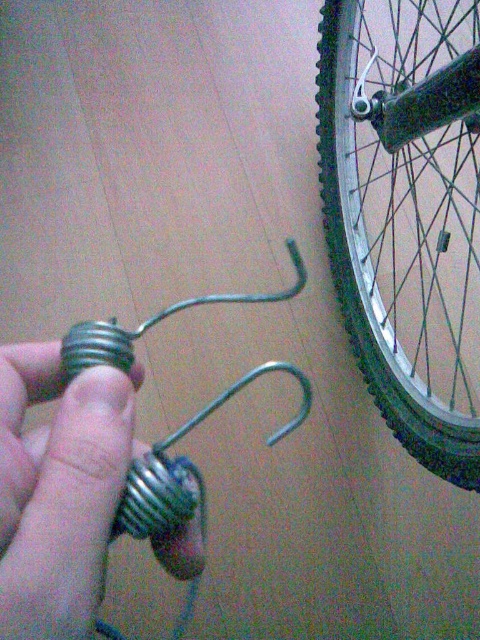
Question: Is metallic silver wheel at right positioned in front of metallic silver hook at lower left?

Choices:
 (A) yes
 (B) no

Answer: (B)

Question: Among these points, which one is nearest to the camera?

Choices:
 (A) (13, 477)
 (B) (436, 416)

Answer: (A)

Question: Is metallic silver wheel at right above metallic silver hook at lower left?

Choices:
 (A) no
 (B) yes

Answer: (B)

Question: Is metallic silver wheel at right below metallic silver hook at lower left?

Choices:
 (A) yes
 (B) no

Answer: (B)

Question: Which of the following is the farthest from the observer?

Choices:
 (A) [76, 616]
 (B) [412, 346]

Answer: (B)

Question: Which point appears closest to the camera in this image?

Choices:
 (A) (104, 474)
 (B) (415, 156)

Answer: (A)